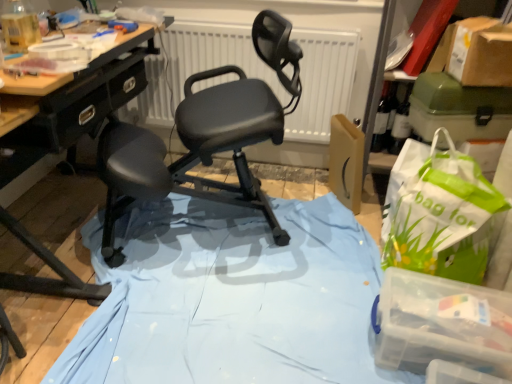
Question: From a real-world perspective, relative to green plastic box at upper right, which is the first box from top to bottom, is light blue fabric at center vertically above or below?

Choices:
 (A) below
 (B) above

Answer: (A)

Question: Is point (139, 231) closer or farther from the camera than point (502, 104)?

Choices:
 (A) farther
 (B) closer

Answer: (A)

Question: Estimate the real-world distances between objects in this image. Which object is farther from the brown cardboard box at upper right?

Choices:
 (A) matte glass bottle at upper right
 (B) transparent plastic container at lower right, the first box ordered from the bottom
 (C) matte black chair at center
 (D) white matte radiator at center
 (E) light blue fabric at center

Answer: (E)

Question: Which object is positioned closest to the white matte radiator at center?

Choices:
 (A) light blue fabric at center
 (B) transparent plastic container at lower right, which is counted as the 2th box, starting from the top
 (C) matte glass bottle at upper right
 (D) brown cardboard box at upper right
 (E) green plastic box at upper right, which is the first box from top to bottom

Answer: (C)